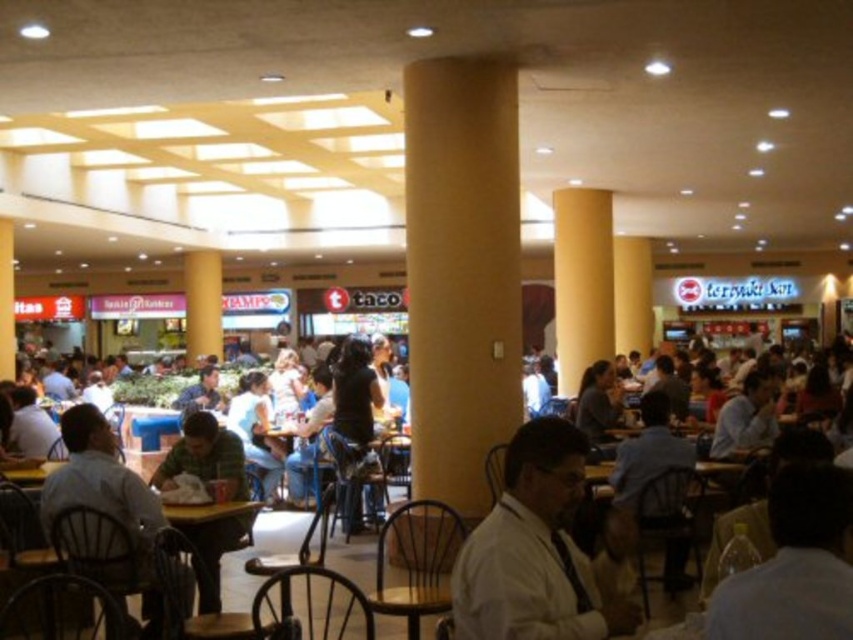
You are a customer sitting at a table in the food court and notice a white fabric shirt at lower right and a light brown wooden chair at lower left. Which object is positioned higher in the scene?

The white fabric shirt at lower right is located above the light brown wooden chair at lower left, so it is positioned higher in the scene.

You are a customer in the food court and want to sit down. You notice a white fabric shirt at lower right and a light brown wooden chair at lower left. Which object is more suitable for sitting?

The light brown wooden chair at lower left is more suitable for sitting because the white fabric shirt at lower right is thinner and not designed for seating.

Based on the photo, you are a customer looking for a place to sit in the food court. You notice the yellow matte column at center and the white fabric shirt at lower right. Which object is bigger in size?

The yellow matte column at center is larger in size compared to the white fabric shirt at lower right.